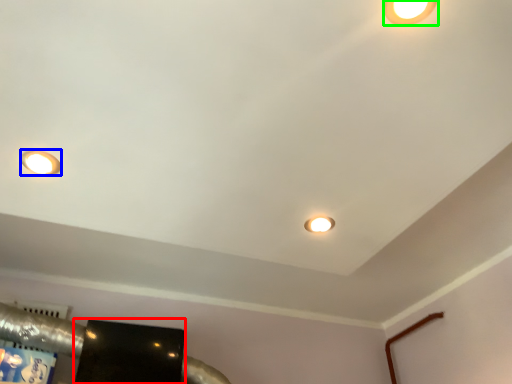
Question: Considering the real-world distances, which object is farthest from wide (highlighted by a red box)? lamp (highlighted by a blue box) or lamp (highlighted by a green box)?

Choices:
 (A) lamp
 (B) lamp

Answer: (B)